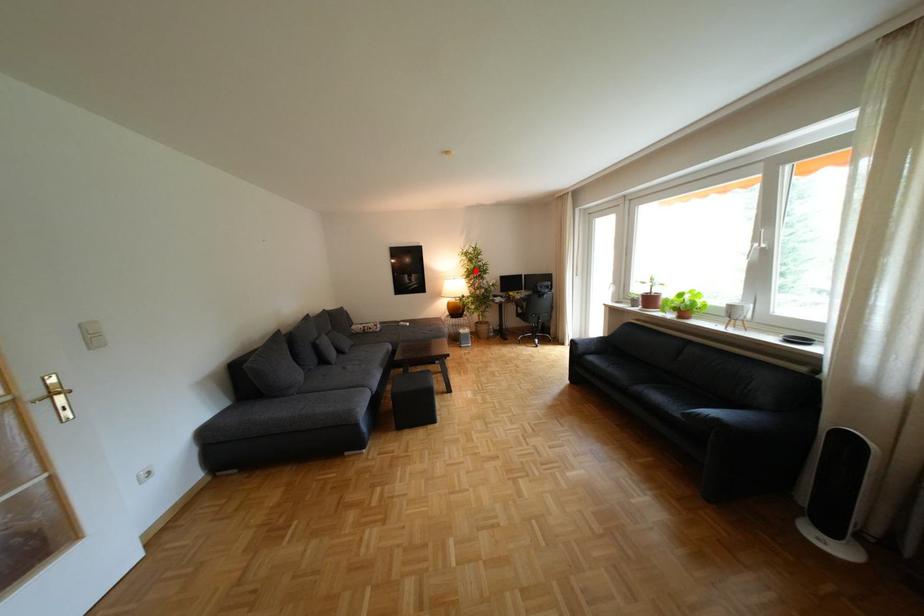
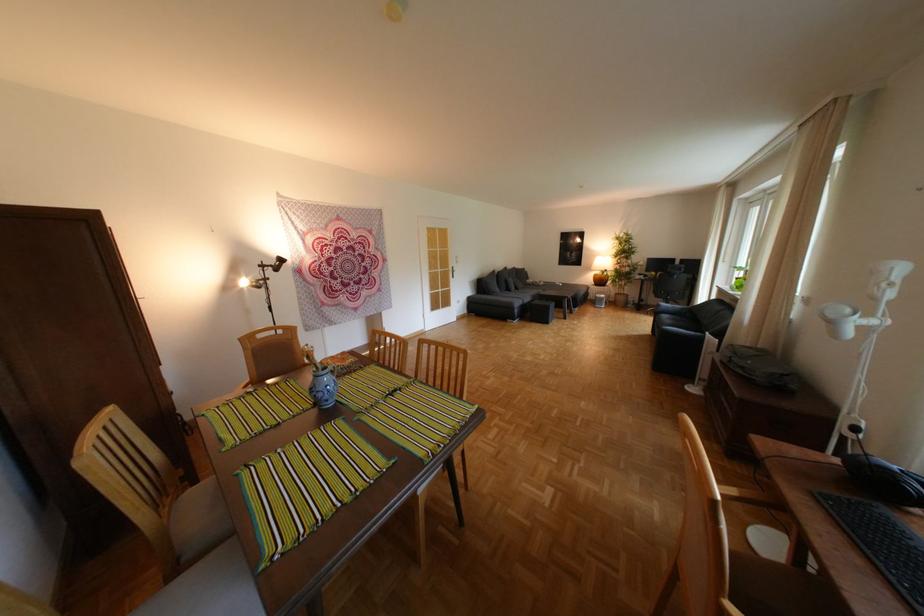
Question: I am providing you with two images of the same scene from different viewpoints. A red point is marked on the first image. Can you still see the location of the red point in image 2?

Choices:
 (A) Yes
 (B) No

Answer: (A)